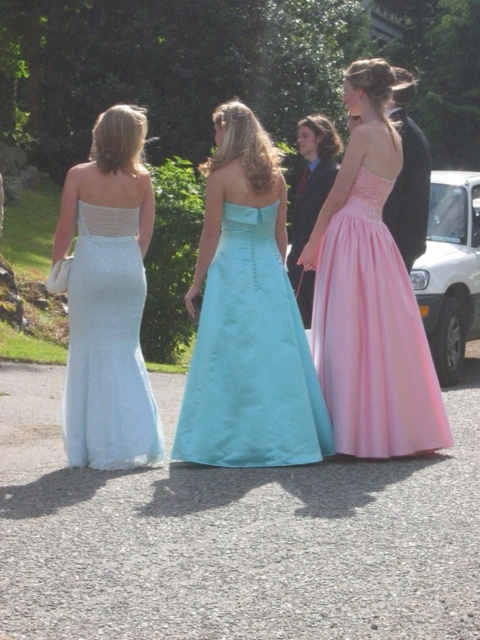
Question: In this image, where is pink satin dress at center located relative to satin white dress at center?

Choices:
 (A) above
 (B) below

Answer: (A)

Question: Does pink satin dress at center have a greater width compared to satin white dress at center?

Choices:
 (A) no
 (B) yes

Answer: (B)

Question: Does pink satin dress at center appear under satin white dress at center?

Choices:
 (A) yes
 (B) no

Answer: (B)

Question: Which point is farther to the camera?

Choices:
 (A) (216, 113)
 (B) (377, 448)
 (C) (291, 330)
 (D) (99, 356)

Answer: (A)

Question: Among these points, which one is nearest to the camera?

Choices:
 (A) (331, 257)
 (B) (96, 225)
 (C) (348, 148)

Answer: (B)

Question: Considering the real-world distances, which object is closest to the pink satin dress at center?

Choices:
 (A) matte satin dress at center
 (B) light blue satin dress at center
 (C) satin white dress at center

Answer: (A)